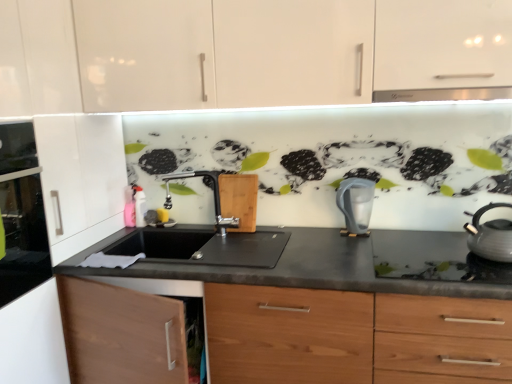
Question: From a real-world perspective, is glass door oven at left above or below black matte countertop at center?

Choices:
 (A) above
 (B) below

Answer: (A)

Question: Is glass door oven at left to the left or to the right of black matte countertop at center in the image?

Choices:
 (A) right
 (B) left

Answer: (B)

Question: Which object is the closest to the black matte countertop at center?

Choices:
 (A) satin nickel faucet at center
 (B) matte gray kettle at right, acting as the second kitchen appliance starting from the back
 (C) white glossy gas stove at right
 (D) translucent plastic pitcher at center, positioned as the 2th kitchen appliance in right-to-left order
 (E) glass door oven at left

Answer: (A)

Question: Estimate the real-world distances between objects in this image. Which object is closer to the white glossy gas stove at right?

Choices:
 (A) black matte countertop at center
 (B) matte gray kettle at right, acting as the second kitchen appliance starting from the back
 (C) glass door oven at left
 (D) translucent plastic pitcher at center, the first kitchen appliance from the back
 (E) satin nickel faucet at center

Answer: (D)